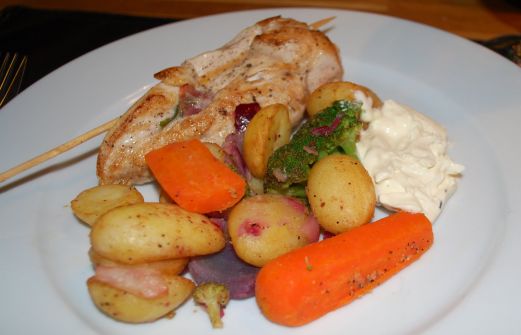
You are a GUI agent. You are given a task and a screenshot of the screen. Output one action in this format:
    pyautogui.click(x=<x>, y=<y>)
    Task: Click on the fork
    The height and width of the screenshot is (335, 521).
    Given the screenshot: What is the action you would take?
    pyautogui.click(x=13, y=77)